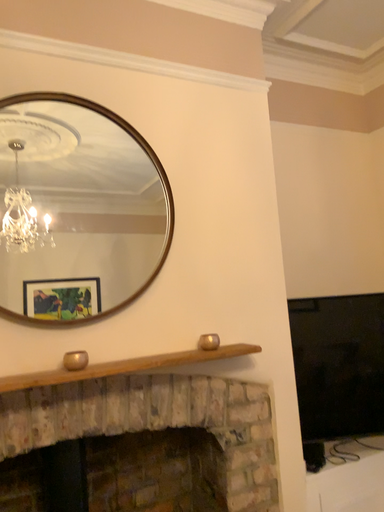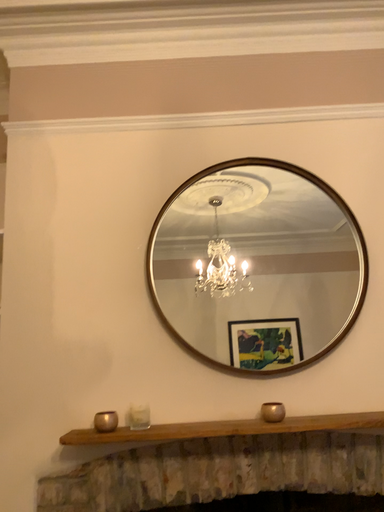
Question: Which way did the camera rotate in the video?

Choices:
 (A) rotated left
 (B) rotated right

Answer: (A)